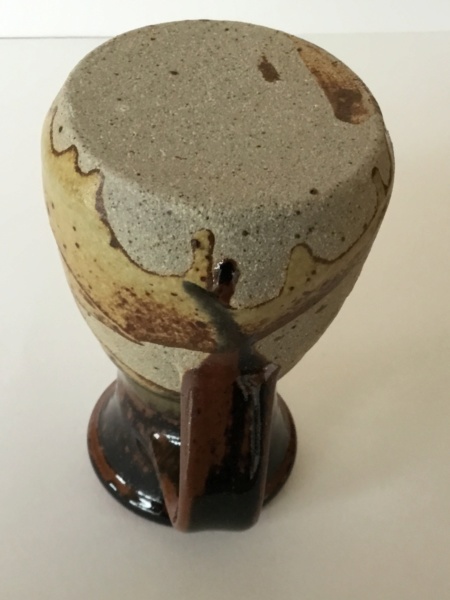
The height and width of the screenshot is (600, 450). In order to click on shadow of pottery piece in this screenshot , I will do `click(315, 478)`.